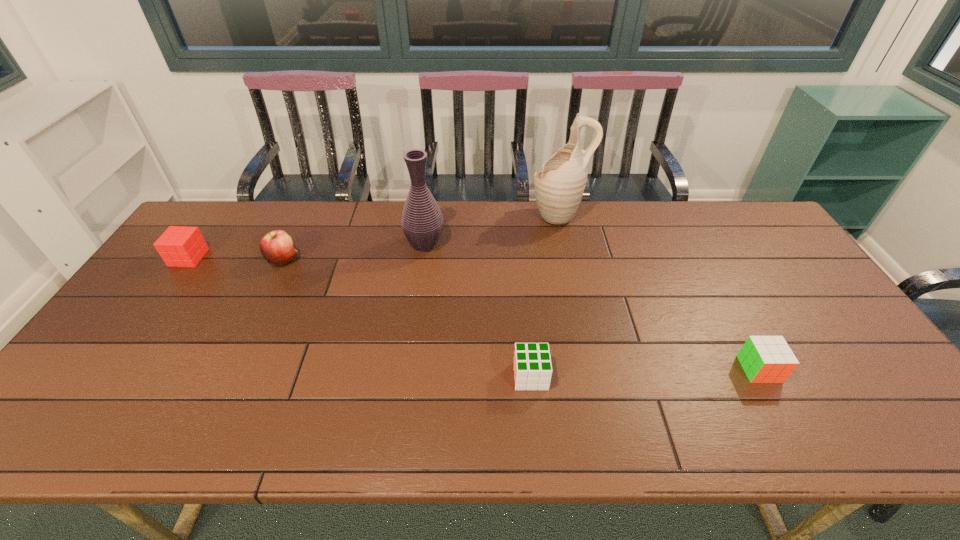
I want to click on vacant space situated 0.080m at the spout of the fifth object from left to right, so click(x=507, y=215).

Image resolution: width=960 pixels, height=540 pixels. In order to click on vacant space located at the spout of the fifth object from left to right in this screenshot , I will do `click(430, 215)`.

Where is `free space located 0.240m on the front of the vase`? This screenshot has width=960, height=540. free space located 0.240m on the front of the vase is located at coordinates (415, 316).

Where is `vacant point located on the front of the fifth object from right to left`? The width and height of the screenshot is (960, 540). vacant point located on the front of the fifth object from right to left is located at coordinates (224, 386).

Identify the location of vacant region located 0.370m on the front of the leftmost object. (108, 370).

Find the location of a particular element. The image size is (960, 540). vacant region located 0.100m on the red face of the fourth object from left to right is located at coordinates (472, 376).

The width and height of the screenshot is (960, 540). What are the coordinates of `blank space located on the red face of the fourth object from left to right` in the screenshot? It's located at (411, 376).

Locate an element on the screen. This screenshot has height=540, width=960. vacant space situated 0.330m on the red face of the fourth object from left to right is located at coordinates pyautogui.click(x=377, y=376).

You are a GUI agent. You are given a task and a screenshot of the screen. Output one action in this format:
    pyautogui.click(x=<x>, y=<y>)
    Task: Click on the free point located on the left of the rightmost object
    
    Given the screenshot: What is the action you would take?
    pyautogui.click(x=620, y=369)

At what (x,y) coordinates should I click in order to perform the action: click on pitcher that is positioned at the far edge. Please return your answer as a coordinate pair (x, y). Looking at the image, I should click on (559, 186).